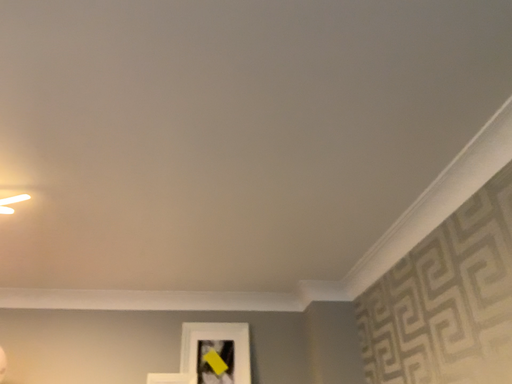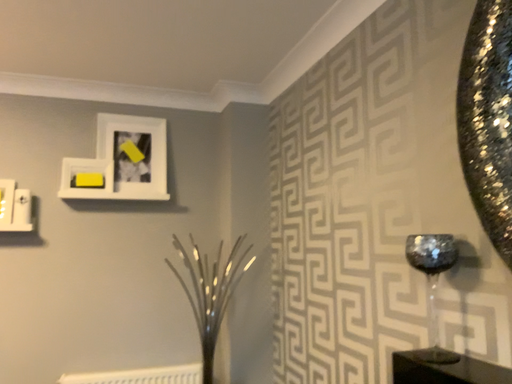
Question: How did the camera likely rotate when shooting the video?

Choices:
 (A) rotated downward
 (B) rotated upward

Answer: (A)